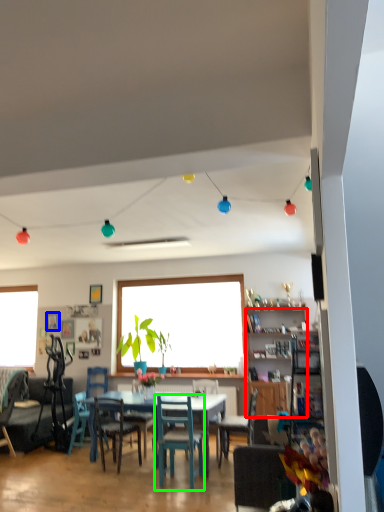
Question: Estimate the real-world distances between objects in this image. Which object is farther from cabinetry (highlighted by a red box), picture frame (highlighted by a blue box) or chair (highlighted by a green box)?

Choices:
 (A) picture frame
 (B) chair

Answer: (A)